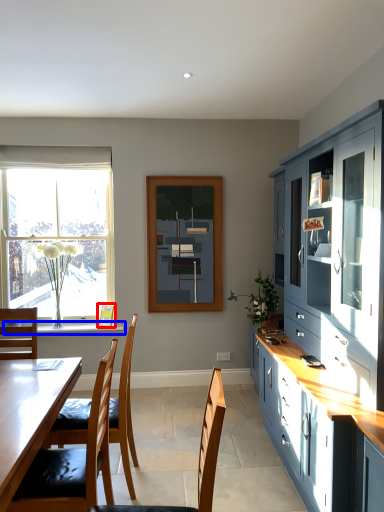
Question: Which of the following is the farthest to the observer, picture frame (highlighted by a red box) or window sill (highlighted by a blue box)?

Choices:
 (A) picture frame
 (B) window sill

Answer: (A)